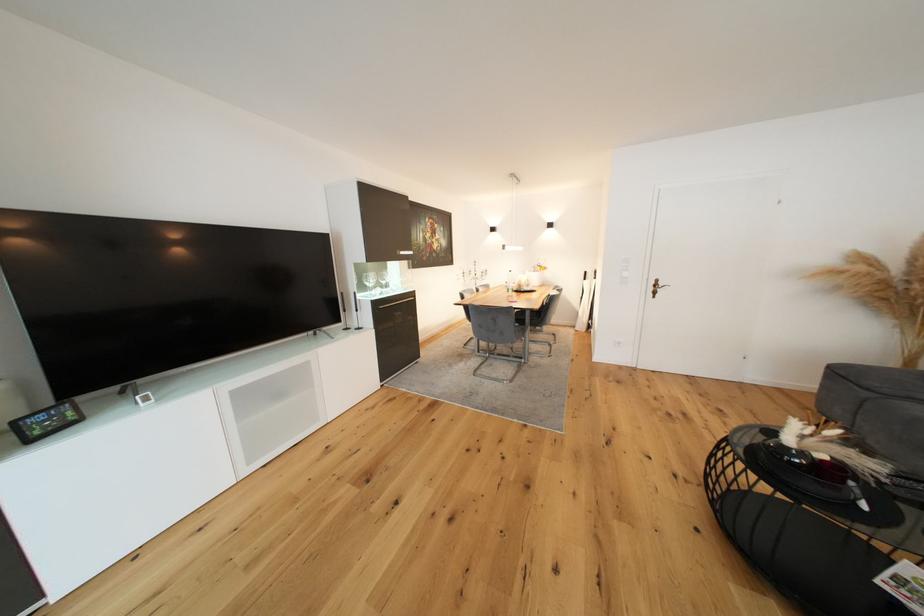
Identify the location of metal door handle. (657, 286).